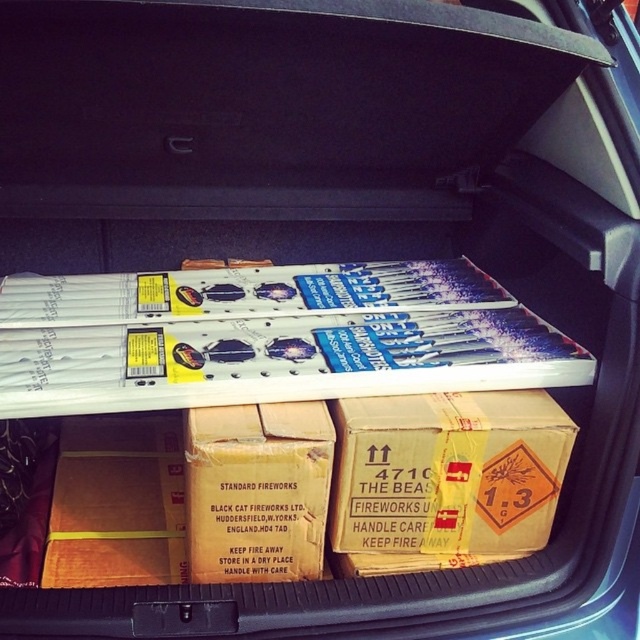
Question: Which of these objects is positioned farthest from the brown cardboard box at lower center?

Choices:
 (A) brown cardboard box at center
 (B) black cardboard box at center

Answer: (B)

Question: Estimate the real-world distances between objects in this image. Which object is farther from the black cardboard box at center?

Choices:
 (A) brown cardboard box at center
 (B) brown cardboard box at lower center

Answer: (B)

Question: Is brown cardboard box at lower center bigger than brown cardboard box at center?

Choices:
 (A) no
 (B) yes

Answer: (B)

Question: Which object is farther from the camera taking this photo?

Choices:
 (A) black cardboard box at center
 (B) brown cardboard box at lower center
 (C) brown cardboard box at center

Answer: (B)

Question: Is brown cardboard box at lower center to the right of brown cardboard box at center from the viewer's perspective?

Choices:
 (A) yes
 (B) no

Answer: (A)

Question: Is black cardboard box at center to the left of brown cardboard box at lower center from the viewer's perspective?

Choices:
 (A) no
 (B) yes

Answer: (B)